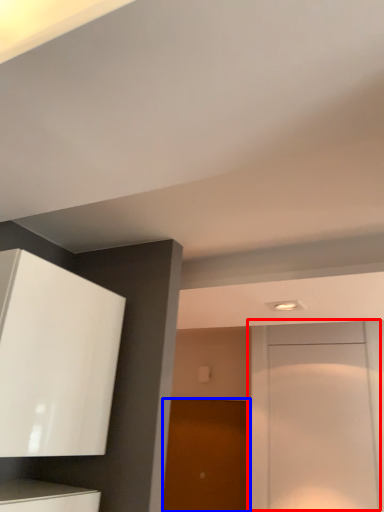
Question: Which object appears closest to the camera in this image, door (highlighted by a red box) or door (highlighted by a blue box)?

Choices:
 (A) door
 (B) door

Answer: (A)